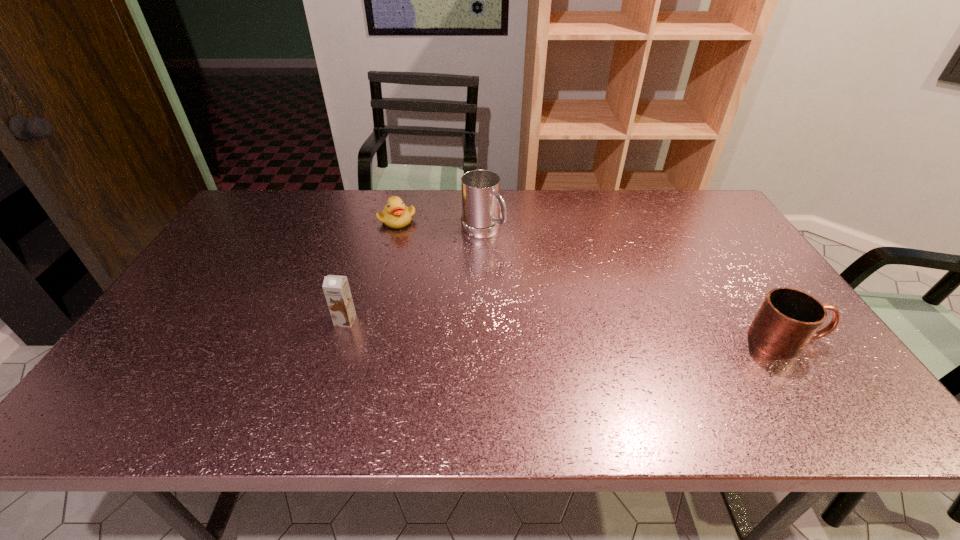
Image resolution: width=960 pixels, height=540 pixels. What are the coordinates of `chocolate milk` in the screenshot? It's located at (336, 288).

Find the location of a particular element. the nearer mug is located at coordinates (788, 319).

Find the location of a particular element. This screenshot has width=960, height=540. the second shortest object is located at coordinates (788, 319).

Locate an element on the screen. the third object from left to right is located at coordinates (480, 189).

I want to click on the tallest object, so click(x=480, y=189).

This screenshot has height=540, width=960. In order to click on duckling in this screenshot , I will do `click(395, 214)`.

Find the location of `free spot located on the front of the second tallest object`. free spot located on the front of the second tallest object is located at coordinates (337, 346).

Where is `free region located 0.180m on the side of the left mug with the handle`? The width and height of the screenshot is (960, 540). free region located 0.180m on the side of the left mug with the handle is located at coordinates (537, 271).

Find the location of `blank area located 0.240m on the side of the left mug with the handle`. blank area located 0.240m on the side of the left mug with the handle is located at coordinates (552, 282).

Image resolution: width=960 pixels, height=540 pixels. What are the coordinates of `free space located on the side of the left mug with the handle` in the screenshot? It's located at (537, 271).